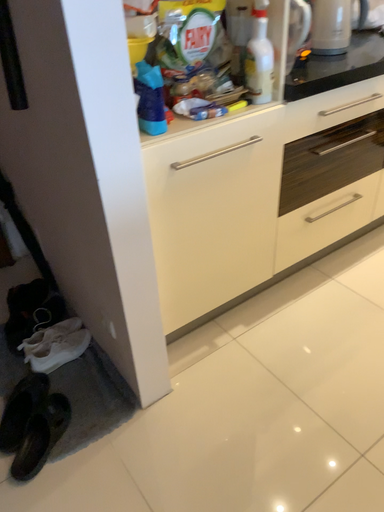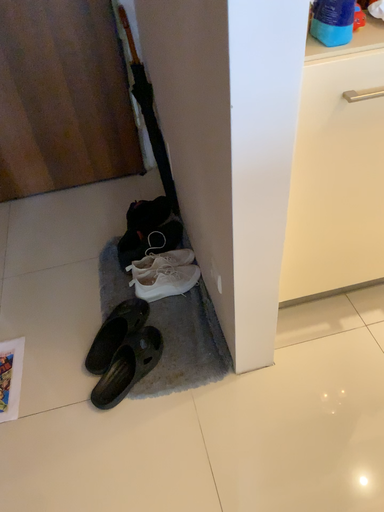
Question: How did the camera likely rotate when shooting the video?

Choices:
 (A) rotated upward
 (B) rotated downward

Answer: (B)